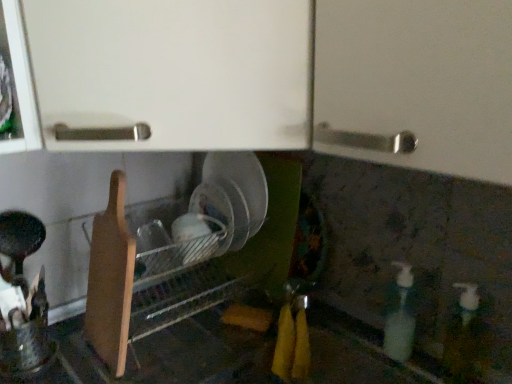
Question: Looking at the image, does white glossy bottle at lower right, which is the second bottle from left to right, seem bigger or smaller compared to translucent plastic soap dispenser at lower right, which is the first bottle from left to right?

Choices:
 (A) small
 (B) big

Answer: (B)

Question: Considering the positions of point (455, 349) and point (410, 354), is point (455, 349) closer or farther from the camera than point (410, 354)?

Choices:
 (A) closer
 (B) farther

Answer: (A)

Question: Estimate the real-world distances between objects in this image. Which object is farther from the wooden cutting board at lower left?

Choices:
 (A) white glossy bottle at lower right, the first bottle positioned from the right
 (B) translucent plastic soap dispenser at lower right, the 2th bottle when ordered from right to left

Answer: (A)

Question: Considering the real-world distances, which object is farthest from the wooden cutting board at lower left?

Choices:
 (A) translucent plastic soap dispenser at lower right, which is the first bottle from left to right
 (B) white glossy bottle at lower right, which is the second bottle from left to right

Answer: (B)